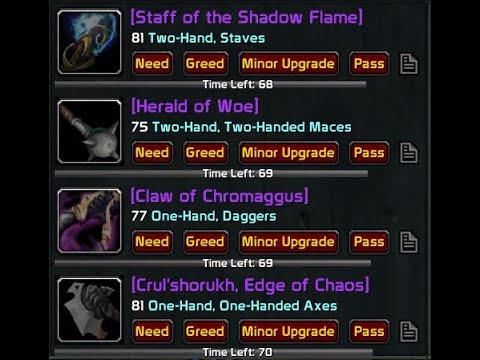
You are a GUI agent. You are given a task and a screenshot of the screen. Output one action in this format:
    pyautogui.click(x=<x>, y=<y>)
    Task: Click on the thumbnail picture
    
    Given the screenshot: What is the action you would take?
    coord(55,39)